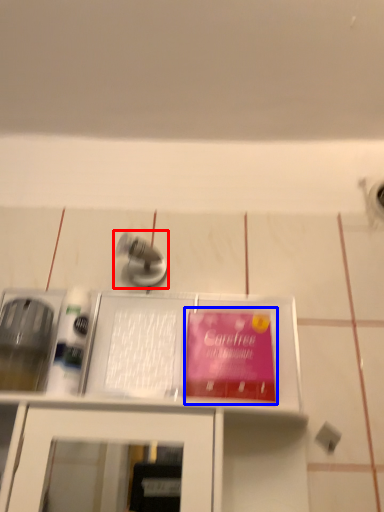
Question: Which point is closer to the camera, tap (highlighted by a red box) or paperback book (highlighted by a blue box)?

Choices:
 (A) tap
 (B) paperback book

Answer: (B)